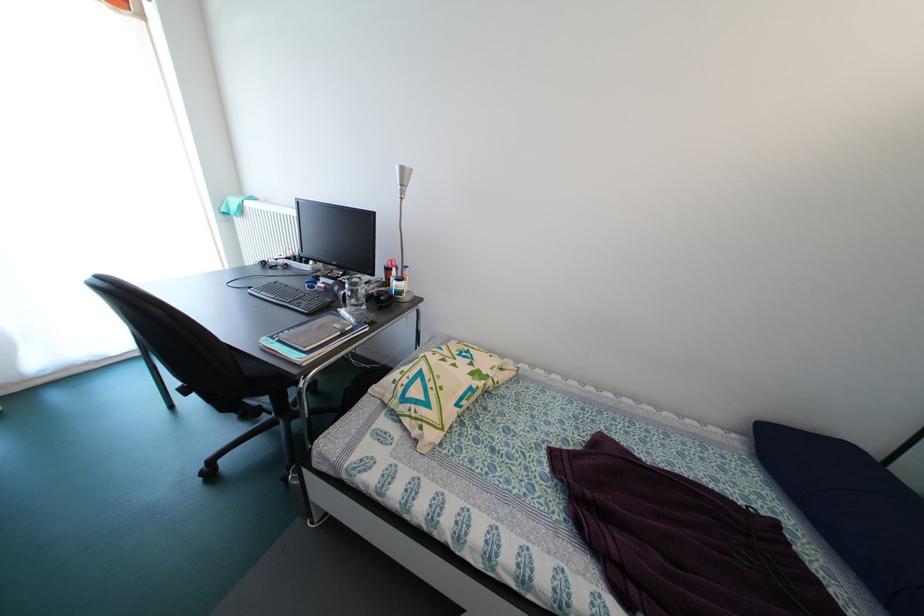
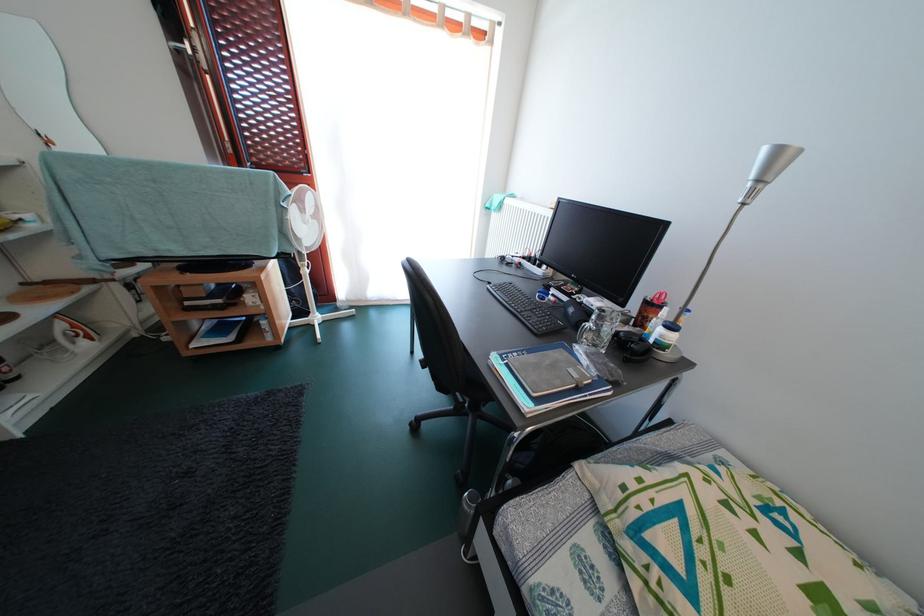
Locate, in the second image, the point that corresponds to the point at 395,288 in the first image.

(648, 328)